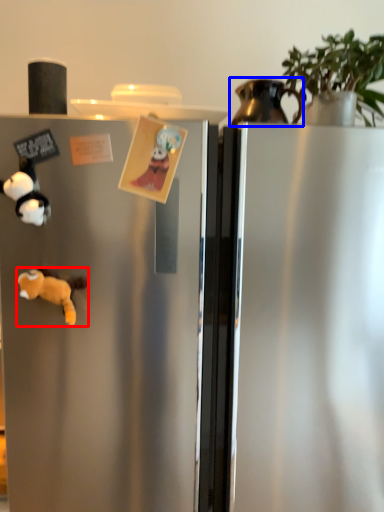
Question: Among these objects, which one is farthest to the camera, animal (highlighted by a red box) or appliance (highlighted by a blue box)?

Choices:
 (A) animal
 (B) appliance

Answer: (B)